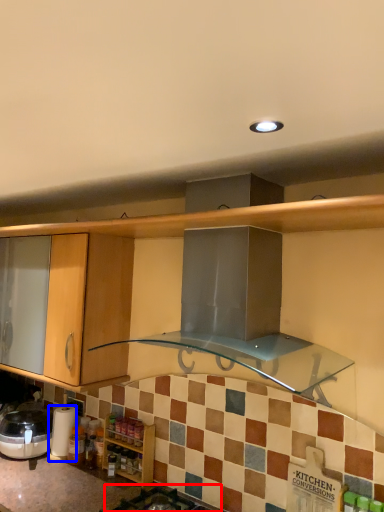
Question: Which object is further to the camera taking this photo, gas stove (highlighted by a red box) or appliance (highlighted by a blue box)?

Choices:
 (A) gas stove
 (B) appliance

Answer: (B)